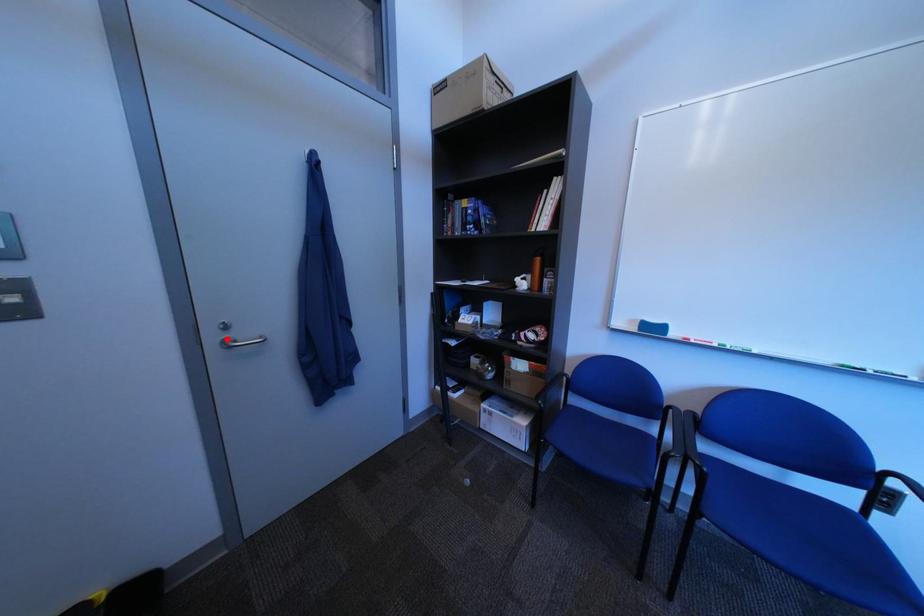
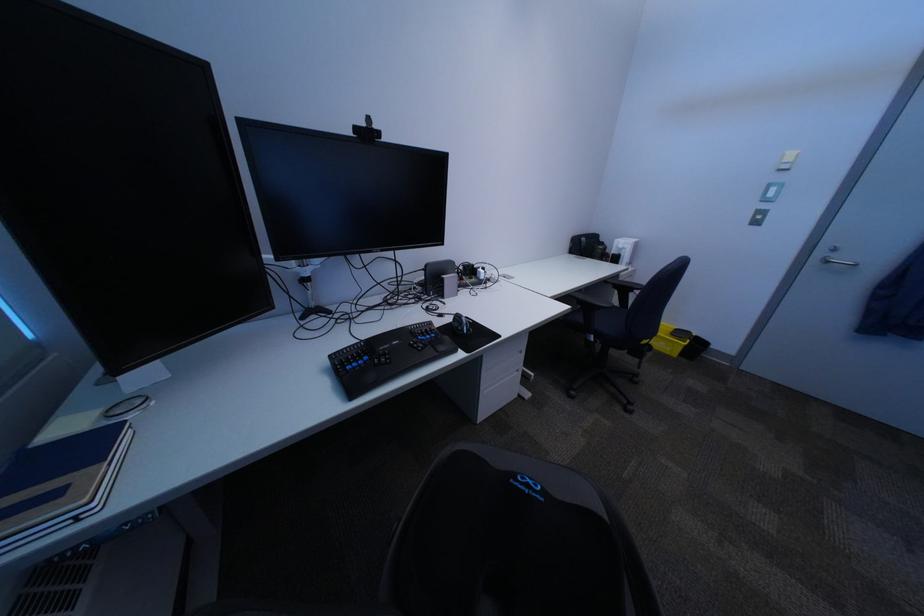
Question: I am providing you with two images of the same scene from different viewpoints. Image1 has a red point marked. In image2, the corresponding 3D location appears at what relative position? Reply with the corresponding letter.

Choices:
 (A) Closer
 (B) Farther

Answer: (B)